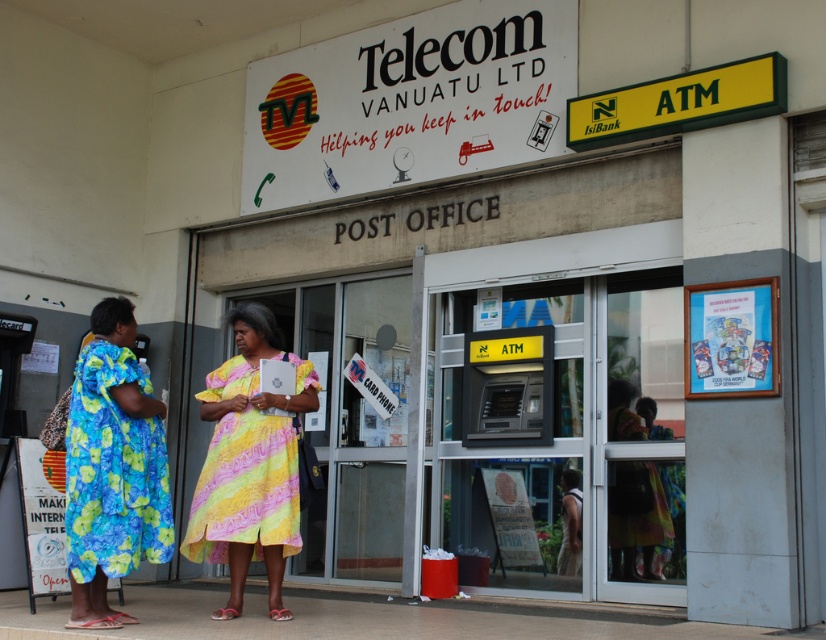
Who is lower down, yellow tie-dye dress at center or yellow floral dress at lower center?

yellow floral dress at lower center is lower down.

Who is positioned more to the right, yellow tie-dye dress at center or yellow floral dress at lower center?

yellow floral dress at lower center is more to the right.

Identify the location of yellow tie-dye dress at center. This screenshot has height=640, width=826. (245, 488).

Where is `yellow tie-dye dress at center`? yellow tie-dye dress at center is located at coordinates (245, 488).

Find the location of a particular element. This screenshot has width=826, height=640. blue tie-dye fabric dress at left is located at coordinates (112, 470).

Is point (93, 456) behind point (241, 438)?

No.

Identify the location of blue tie-dye fabric dress at left. (112, 470).

Does blue tie-dye fabric dress at left have a greater width compared to yellow floral dress at lower center?

Yes, blue tie-dye fabric dress at left is wider than yellow floral dress at lower center.

Is blue tie-dye fabric dress at left bigger than yellow floral dress at lower center?

Correct, blue tie-dye fabric dress at left is larger in size than yellow floral dress at lower center.

Is point (141, 376) less distant than point (616, 500)?

That is True.

Where is `blue tie-dye fabric dress at left`? blue tie-dye fabric dress at left is located at coordinates (112, 470).